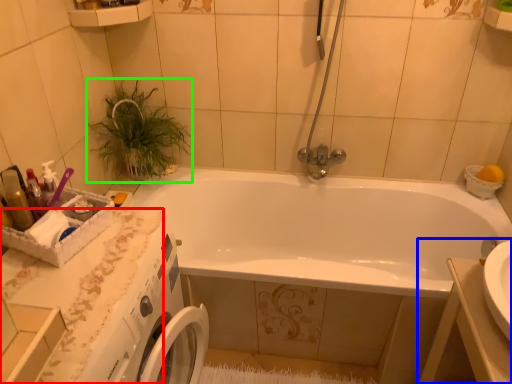
Question: Estimate the real-world distances between objects in this image. Which object is closer to counter top (highlighted by a red box), sink (highlighted by a blue box) or plant (highlighted by a green box)?

Choices:
 (A) sink
 (B) plant

Answer: (B)